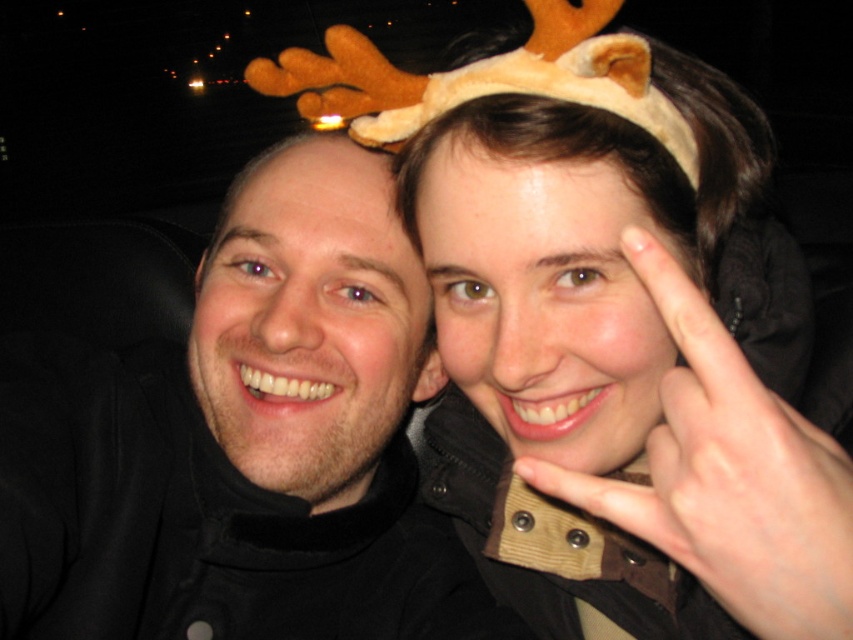
In the scene shown: Does fuzzy brown headband at upper center have a lesser height compared to matte black jacket at center?

Incorrect, fuzzy brown headband at upper center's height does not fall short of matte black jacket at center's.

Is fuzzy brown headband at upper center to the right of matte black jacket at center from the viewer's perspective?

Yes, fuzzy brown headband at upper center is to the right of matte black jacket at center.

The image size is (853, 640). What are the coordinates of `fuzzy brown headband at upper center` in the screenshot? It's located at (616, 374).

Is point (131, 353) behind point (281, 413)?

That is True.

How distant is matte black jacket at center from matte black hair at left?

matte black jacket at center and matte black hair at left are 1.44 inches apart from each other.

Is point (274, 486) positioned before point (221, 400)?

No.

Find the location of a particular element. Image resolution: width=853 pixels, height=640 pixels. matte black jacket at center is located at coordinates (244, 442).

Is fuzzy brown headband at upper center bigger than matte black hair at left?

Indeed, fuzzy brown headband at upper center has a larger size compared to matte black hair at left.

Who is positioned more to the right, fuzzy brown headband at upper center or matte black hair at left?

Positioned to the right is fuzzy brown headband at upper center.

Who is more distant from viewer, (553, 312) or (315, 305)?

The point (315, 305) is more distant.

At what (x,y) coordinates should I click in order to perform the action: click on fuzzy brown headband at upper center. Please return your answer as a coordinate pair (x, y). Image resolution: width=853 pixels, height=640 pixels. Looking at the image, I should click on (616, 374).